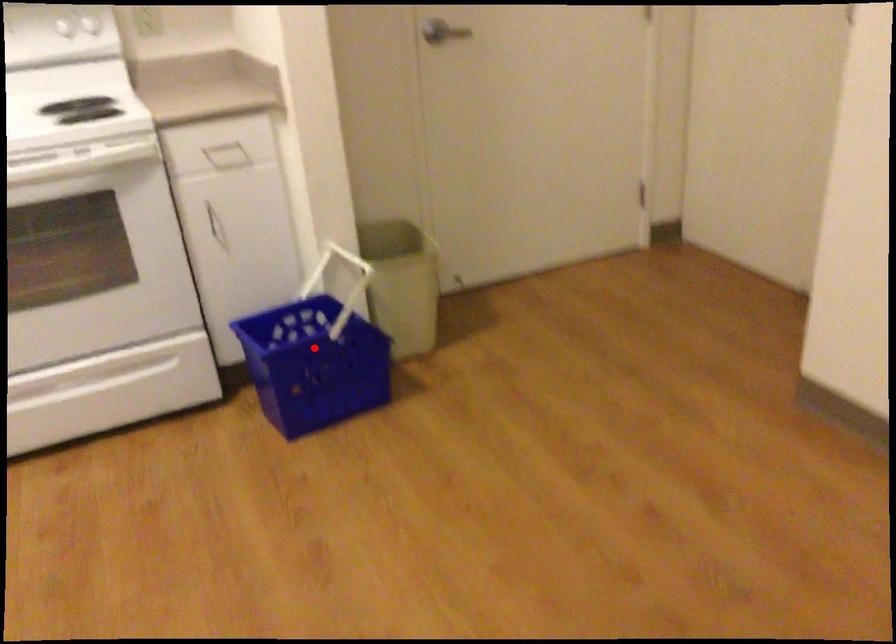
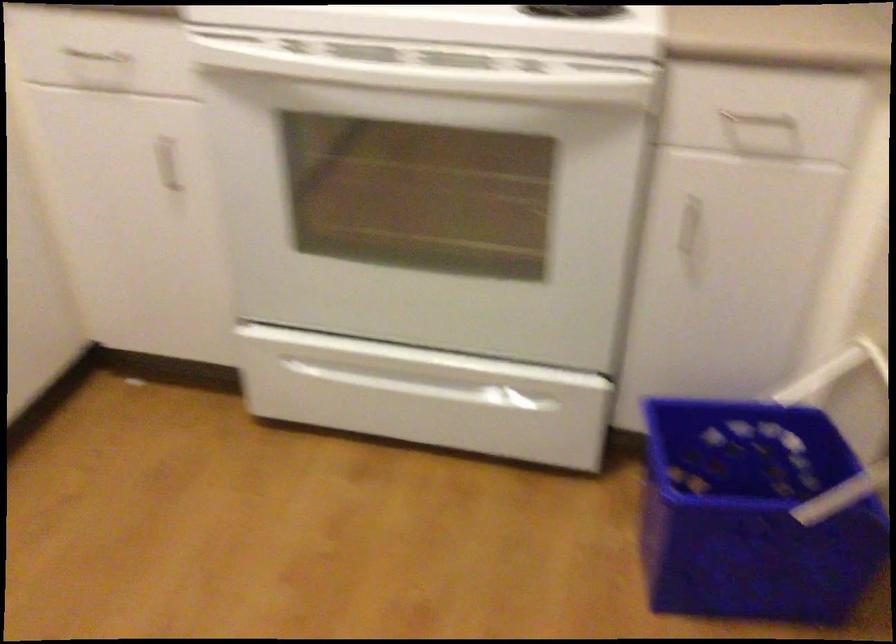
Question: I am providing you with two images of the same scene from different viewpoints. In image1, a red point is highlighted. Considering the same 3D point in image2, which of the following is correct?

Choices:
 (A) It is closer
 (B) It is farther

Answer: (A)